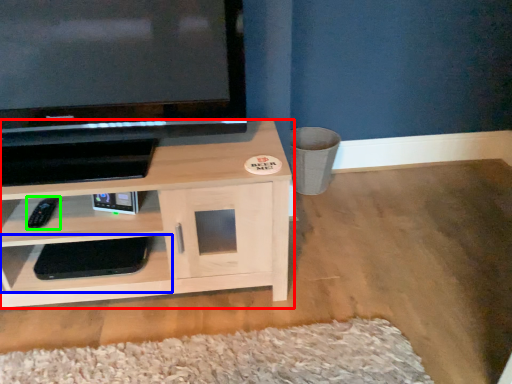
Question: Estimate the real-world distances between objects in this image. Which object is farther from shelf (highlighted by a red box), shelf (highlighted by a blue box) or remote (highlighted by a green box)?

Choices:
 (A) shelf
 (B) remote

Answer: (B)